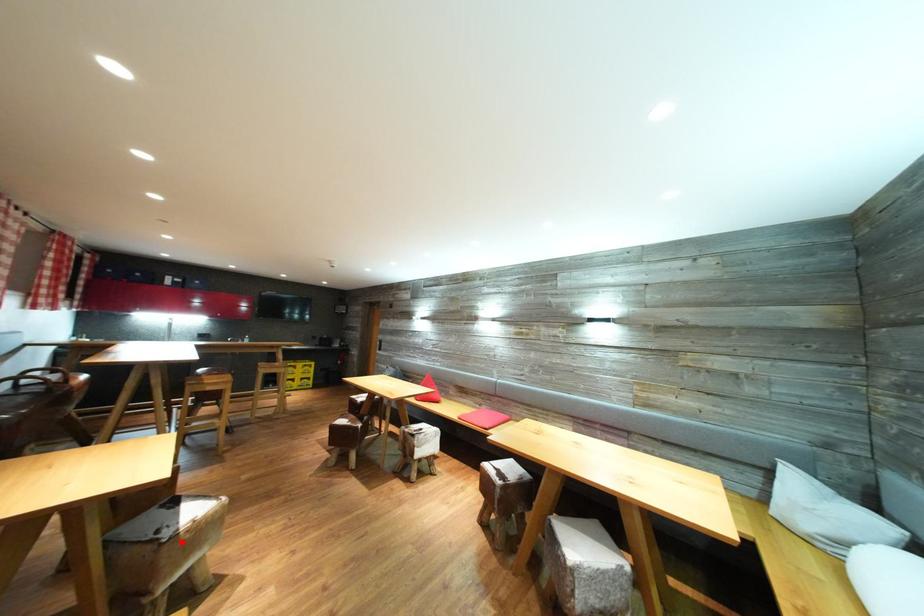
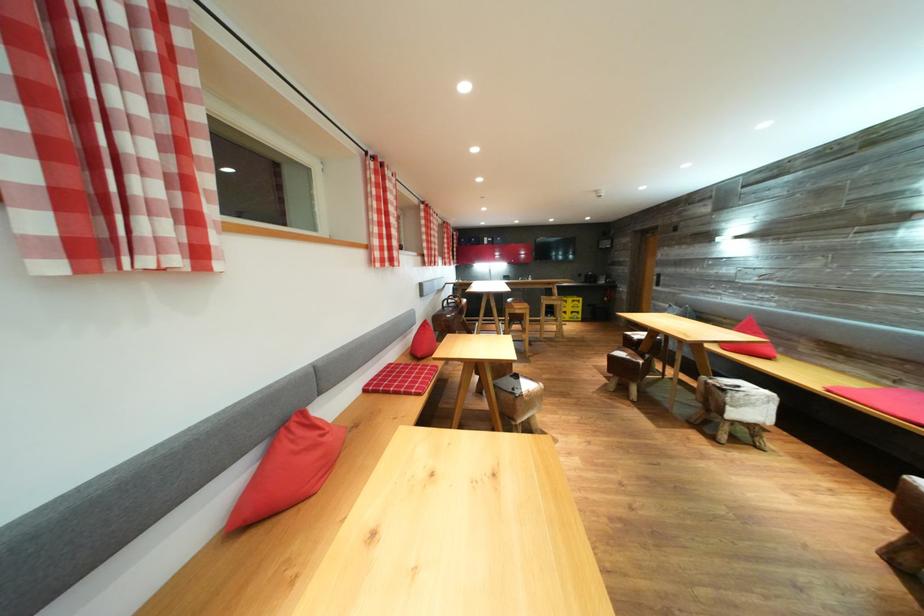
Question: I am providing you with two images of the same scene from different viewpoints. Given a red point in image1, look at the same physical point in image2. Is it:

Choices:
 (A) Closer to the viewpoint
 (B) Farther from the viewpoint

Answer: (B)